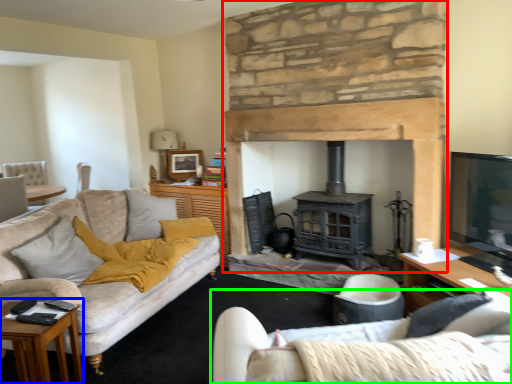
Question: Based on their relative distances, which object is farther from fireplace (highlighted by a red box)? Choose from table (highlighted by a blue box) and studio couch (highlighted by a green box).

Choices:
 (A) table
 (B) studio couch

Answer: (A)